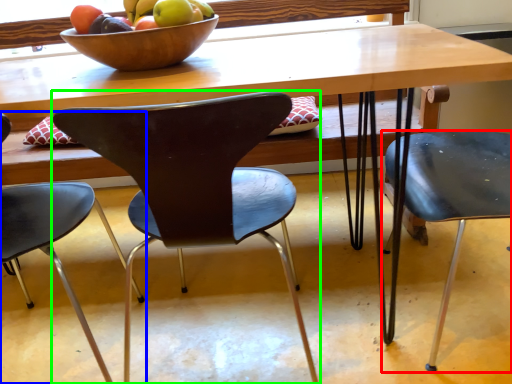
Question: Considering the real-world distances, which object is farthest from chair (highlighted by a red box)? chair (highlighted by a blue box) or chair (highlighted by a green box)?

Choices:
 (A) chair
 (B) chair

Answer: (A)